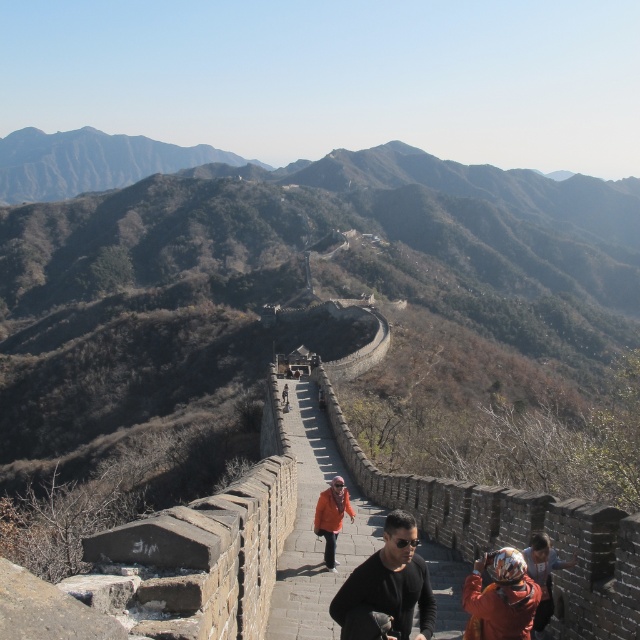
Is orange fabric headscarf at lower right positioned before orange fabric jacket at center?

That is True.

Which is more to the right, orange fabric headscarf at lower right or orange fabric jacket at center?

From the viewer's perspective, orange fabric headscarf at lower right appears more on the right side.

Where is `orange fabric headscarf at lower right`? Image resolution: width=640 pixels, height=640 pixels. orange fabric headscarf at lower right is located at coordinates (544, 576).

Can you confirm if black matte jacket at center is thinner than orange helmet at lower right?

No.

Locate an element on the screen. The image size is (640, 640). black matte jacket at center is located at coordinates (387, 586).

Does point (333, 611) come behind point (330, 540)?

No, it is in front of (330, 540).

Is black matte jacket at center thinner than orange fabric jacket at center?

In fact, black matte jacket at center might be wider than orange fabric jacket at center.

Is point (387, 528) more distant than point (337, 481)?

No.

Where is `black matte jacket at center`? black matte jacket at center is located at coordinates (387, 586).